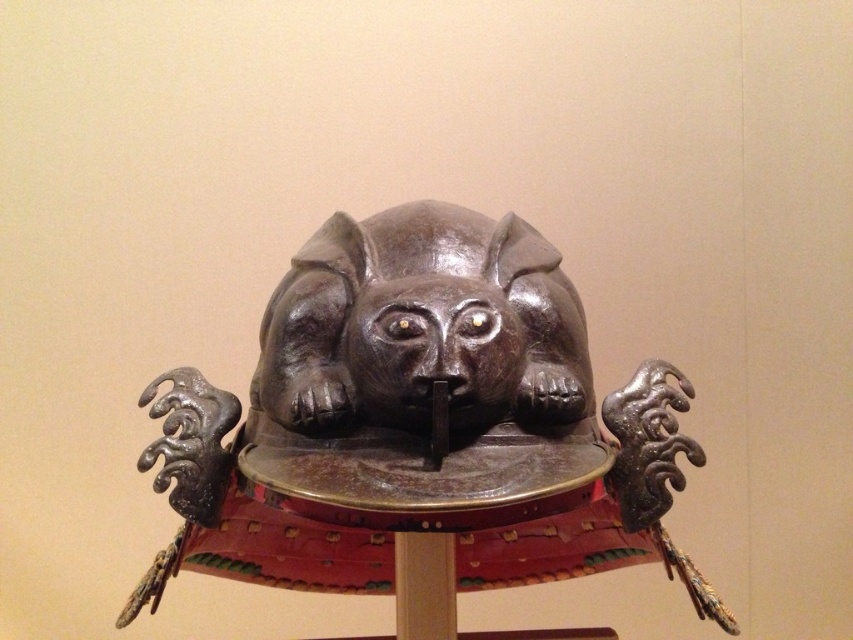
Does shiny dark brown helmet at center appear under shiny brown helmet at center?

Indeed, shiny dark brown helmet at center is positioned under shiny brown helmet at center.

Between point (505, 394) and point (262, 410), which one is positioned behind?

Point (262, 410)

Image resolution: width=853 pixels, height=640 pixels. What do you see at coordinates (421, 429) in the screenshot?
I see `shiny dark brown helmet at center` at bounding box center [421, 429].

Where is `shiny dark brown helmet at center`? This screenshot has width=853, height=640. shiny dark brown helmet at center is located at coordinates (421, 429).